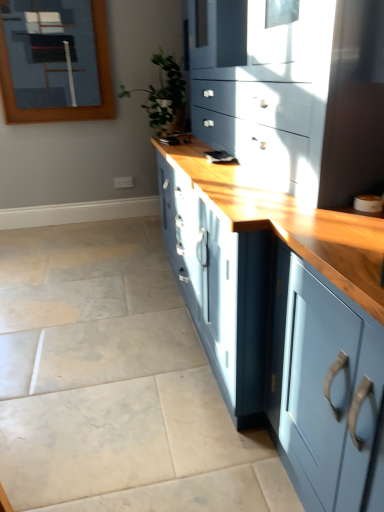
Question: Is green leafy plant at center in front of matte blue cabinet at center?

Choices:
 (A) no
 (B) yes

Answer: (A)

Question: Is green leafy plant at center facing away from matte blue cabinet at center?

Choices:
 (A) no
 (B) yes

Answer: (B)

Question: From the image's perspective, is green leafy plant at center over matte blue cabinet at center?

Choices:
 (A) yes
 (B) no

Answer: (A)

Question: Is the position of green leafy plant at center more distant than that of matte blue cabinet at center?

Choices:
 (A) yes
 (B) no

Answer: (A)

Question: Is green leafy plant at center to the right of matte blue cabinet at center from the viewer's perspective?

Choices:
 (A) no
 (B) yes

Answer: (A)

Question: Considering the positions of green leafy plant at center and matte blue cabinet at center in the image, is green leafy plant at center taller or shorter than matte blue cabinet at center?

Choices:
 (A) short
 (B) tall

Answer: (A)

Question: Is green leafy plant at center situated inside matte blue cabinet at center or outside?

Choices:
 (A) inside
 (B) outside

Answer: (A)

Question: From a real-world perspective, is green leafy plant at center above or below matte blue cabinet at center?

Choices:
 (A) below
 (B) above

Answer: (B)

Question: Looking at their shapes, would you say green leafy plant at center is wider or thinner than matte blue cabinet at center?

Choices:
 (A) wide
 (B) thin

Answer: (B)

Question: From a real-world perspective, is green leafy plant at center above or below wooden frame at upper left?

Choices:
 (A) above
 (B) below

Answer: (B)

Question: From the image's perspective, is green leafy plant at center located above or below wooden frame at upper left?

Choices:
 (A) above
 (B) below

Answer: (B)

Question: Is point (168, 69) positioned closer to the camera than point (69, 58)?

Choices:
 (A) farther
 (B) closer

Answer: (B)

Question: Considering the positions of green leafy plant at center and wooden frame at upper left in the image, is green leafy plant at center taller or shorter than wooden frame at upper left?

Choices:
 (A) short
 (B) tall

Answer: (A)

Question: From a real-world perspective, is matte blue cabinet at center physically located above or below wooden frame at upper left?

Choices:
 (A) above
 (B) below

Answer: (B)

Question: Considering the positions of matte blue cabinet at center and wooden frame at upper left in the image, is matte blue cabinet at center bigger or smaller than wooden frame at upper left?

Choices:
 (A) big
 (B) small

Answer: (A)